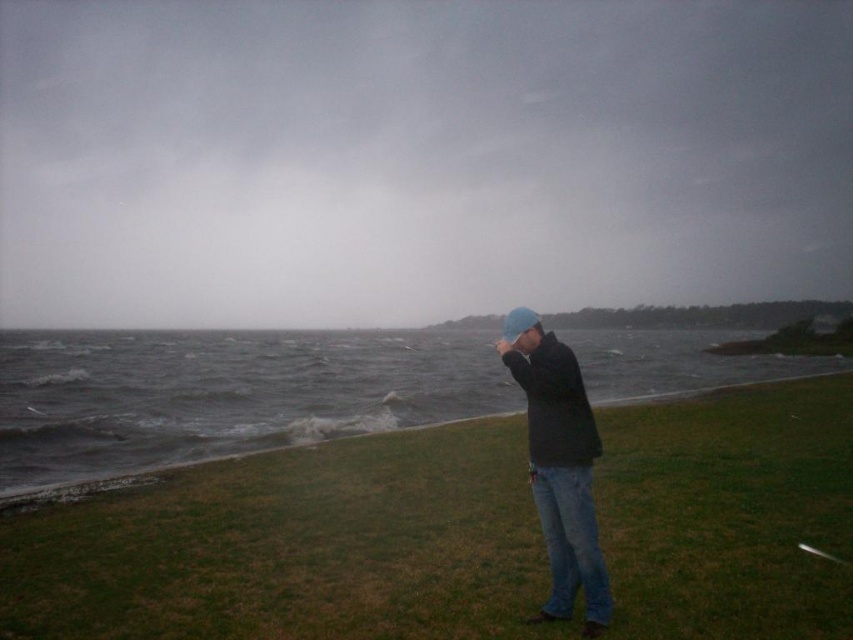
Is green grass at lower right above blue knit cap at center?

No.

Is point (844, 544) in front of point (558, 614)?

No, it is behind (558, 614).

Image resolution: width=853 pixels, height=640 pixels. What do you see at coordinates (293, 547) in the screenshot?
I see `green grass at lower right` at bounding box center [293, 547].

The height and width of the screenshot is (640, 853). In order to click on green grass at lower right in this screenshot , I will do `click(293, 547)`.

Which is in front, point (49, 388) or point (511, 316)?

Point (511, 316) is more forward.

Is point (363, 426) closer to camera compared to point (538, 416)?

No, it is not.

Where is `gray water at lower left`? The width and height of the screenshot is (853, 640). gray water at lower left is located at coordinates (222, 394).

Between green grass at lower right and gray water at lower left, which one is positioned higher?

green grass at lower right is higher up.

Is green grass at lower right positioned at the back of gray water at lower left?

No, green grass at lower right is closer to the viewer.

At what (x,y) coordinates should I click in order to perform the action: click on green grass at lower right. Please return your answer as a coordinate pair (x, y). Looking at the image, I should click on (293, 547).

In order to click on green grass at lower right in this screenshot , I will do `click(293, 547)`.